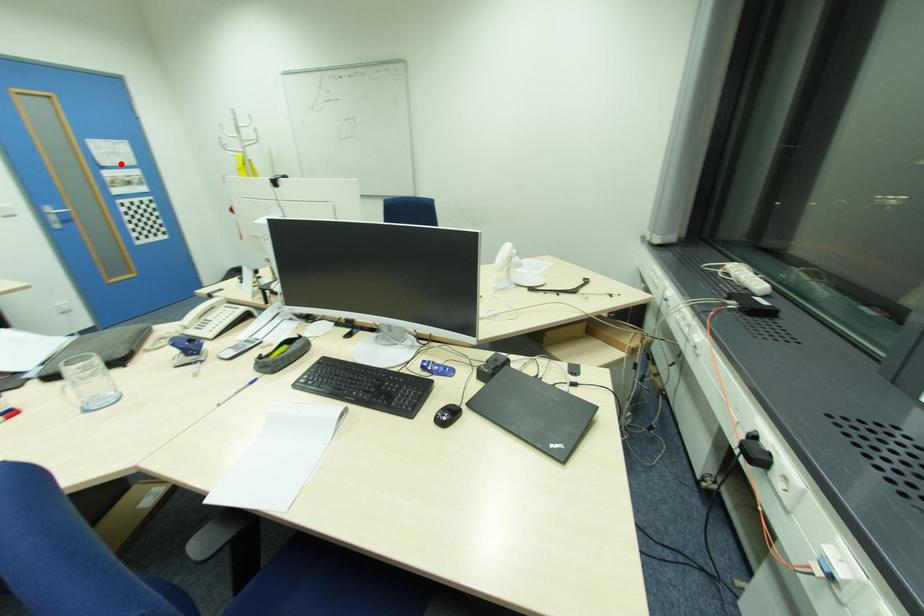
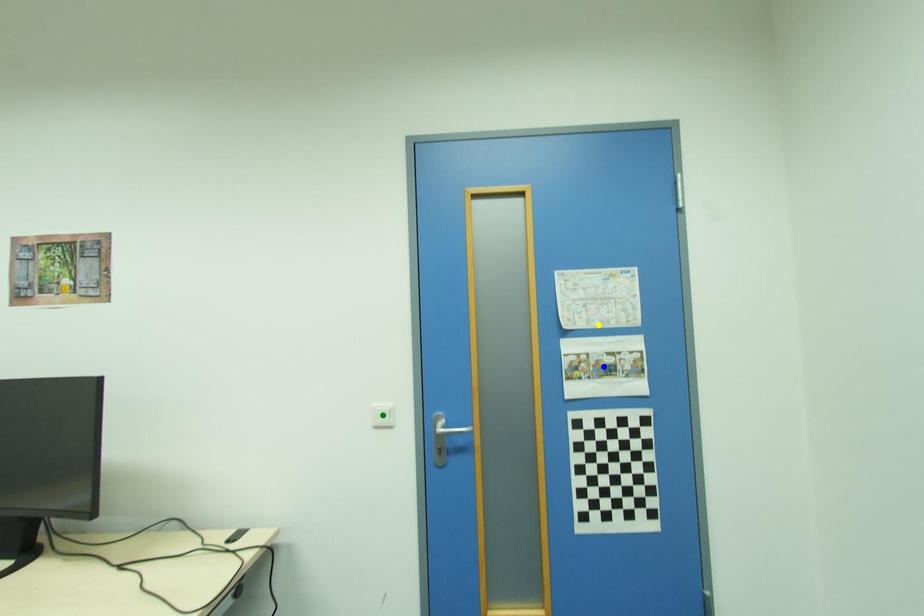
Question: I am providing you with two images of the same scene from different viewpoints. A red point is marked on the first image. You are given multiple points on the second image. Which point in image 2 represents the same 3d spot as the red point in image 1?

Choices:
 (A) yellow point
 (B) blue point
 (C) green point

Answer: (A)